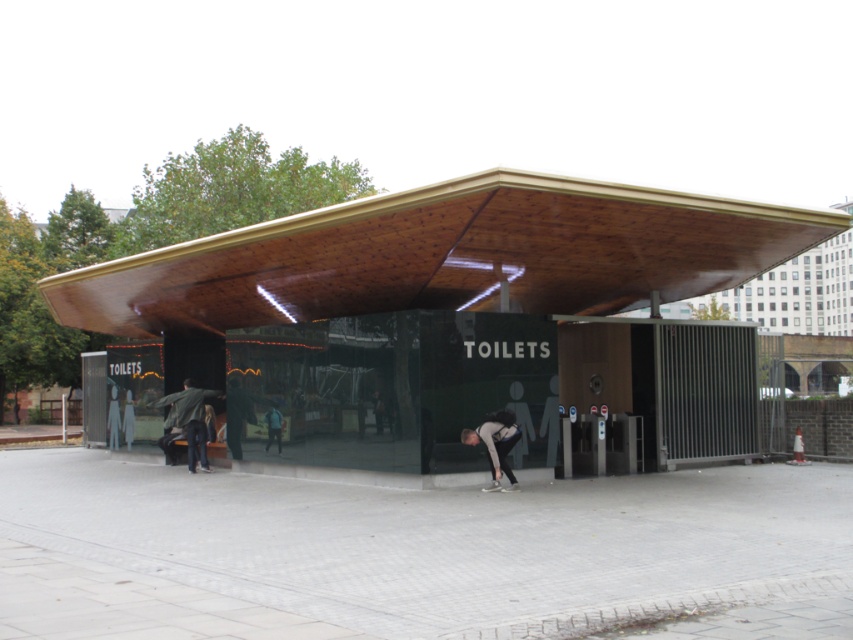
You are a delivery person trying to find the restroom entrance. You see the gray fabric skateboarder at lower center. Based on its location, can you estimate where the restroom entrance is located relative to the skateboarder?

The gray fabric skateboarder at lower center is positioned at point (495, 444), so the restroom entrance is likely located to the left of the skateboarder since the entrance area includes metal security gates and signage indicating the presence of restrooms.

You are a photographer trying to capture both the green fabric jacket at lower left and the blue shirt at lower center in a single frame. Given their sizes, which one should you focus on to ensure both are clearly visible in the photo?

The green fabric jacket at lower left is larger than the blue shirt at lower center, so focusing on the green fabric jacket at lower left will help ensure both are clearly visible in the photo.

You are a delivery person standing at the entrance of the restroom. You need to hand a package to the person wearing the green fabric jacket at lower left and the blue shirt at lower center. Can you reach both individuals without moving from your current position?

The green fabric jacket at lower left and blue shirt at lower center are 6.91 feet apart from each other. Since you are at the entrance, you can likely reach both individuals as they are within a reasonable distance, but you might need to extend your arm or take a few steps forward depending on the exact layout.